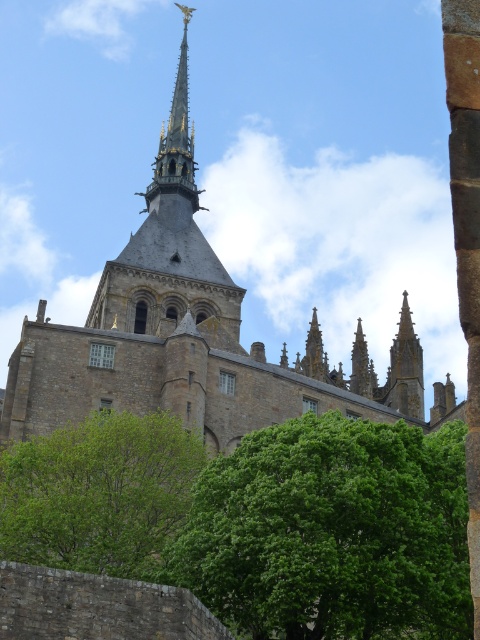
Question: Among these objects, which one is nearest to the camera?

Choices:
 (A) dark gray stone church tower at center
 (B) green leafy tree at center
 (C) green leafy tree at lower left

Answer: (B)

Question: Among these points, which one is farthest from the camera?

Choices:
 (A) (85, 422)
 (B) (269, 554)

Answer: (A)

Question: Can you confirm if green leafy tree at center is positioned to the right of dark gray stone church tower at center?

Choices:
 (A) no
 (B) yes

Answer: (B)

Question: Observing the image, what is the correct spatial positioning of green leafy tree at center in reference to green leafy tree at lower left?

Choices:
 (A) above
 (B) below

Answer: (B)

Question: Considering the relative positions of green leafy tree at lower left and dark gray stone church tower at center in the image provided, where is green leafy tree at lower left located with respect to dark gray stone church tower at center?

Choices:
 (A) below
 (B) above

Answer: (A)

Question: Which object is farther from the camera taking this photo?

Choices:
 (A) green leafy tree at lower left
 (B) dark gray stone church tower at center

Answer: (B)